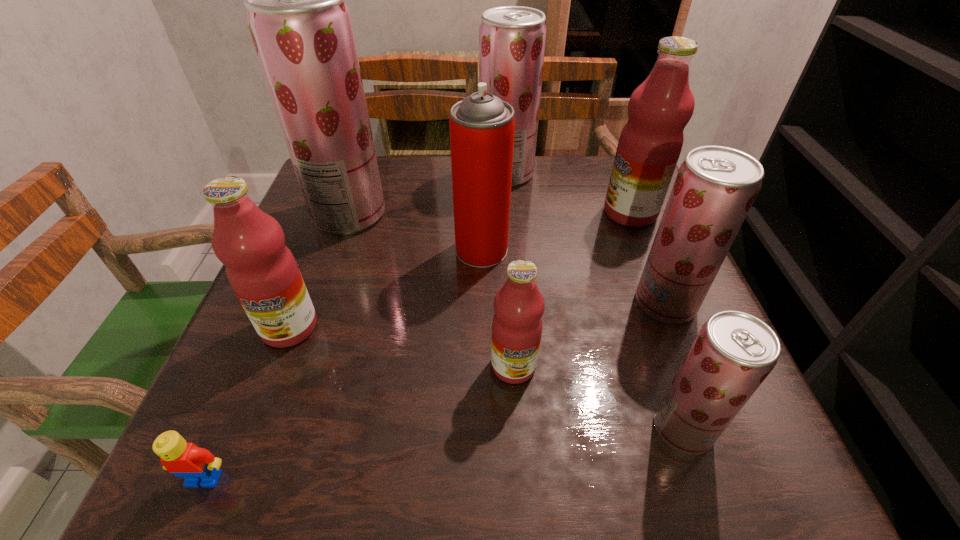
Image resolution: width=960 pixels, height=540 pixels. I want to click on the biggest strawberry fruit juice, so click(301, 28).

This screenshot has width=960, height=540. What are the coordinates of `the third nearest strawberry fruit juice` in the screenshot? It's located at (301, 28).

Find the location of a particular element. This screenshot has width=960, height=540. the third strawberry fruit juice from right to left is located at coordinates (512, 39).

The height and width of the screenshot is (540, 960). I want to click on the farthest strawberry fruit juice, so click(512, 39).

What are the coordinates of `the biggest pink fruit juice` in the screenshot? It's located at (659, 109).

The width and height of the screenshot is (960, 540). I want to click on the rightmost pink fruit juice, so click(x=659, y=109).

You are a GUI agent. You are given a task and a screenshot of the screen. Output one action in this format:
    pyautogui.click(x=<x>, y=<y>)
    Task: Click on the red aerosol can
    Image resolution: width=960 pixels, height=540 pixels.
    Given the screenshot: What is the action you would take?
    pyautogui.click(x=482, y=126)

The image size is (960, 540). In order to click on the third farthest strawberry fruit juice in this screenshot , I will do `click(715, 187)`.

Identify the location of the leftmost pink fruit juice. The height and width of the screenshot is (540, 960). (262, 271).

Where is `the second pink fruit juice from left to right`? The image size is (960, 540). the second pink fruit juice from left to right is located at coordinates (519, 305).